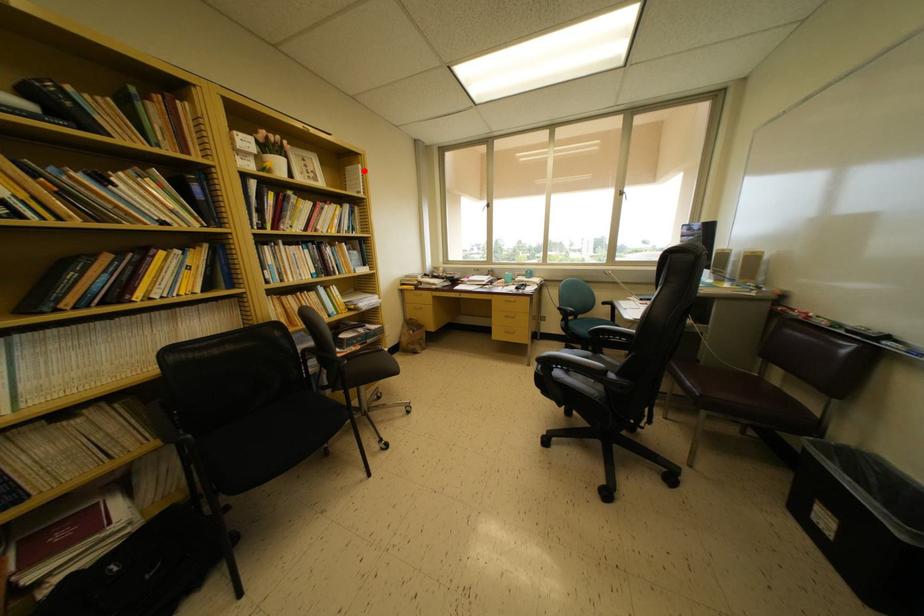
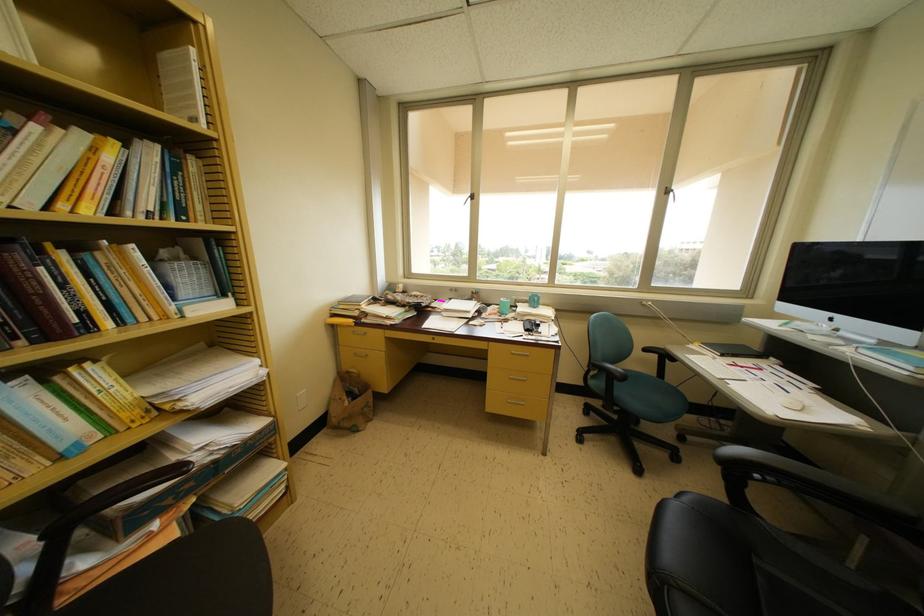
In the second image, find the point that corresponds to the highlighted location in the first image.

(197, 55)